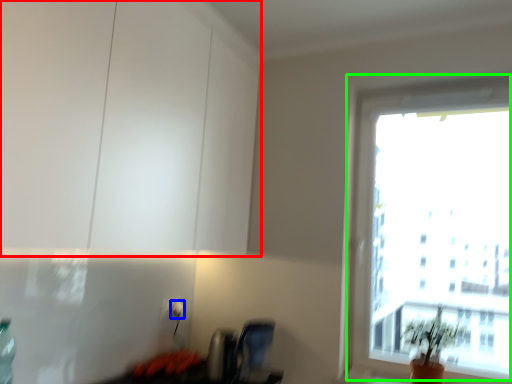
Question: Which object is the farthest from cabinetry (highlighted by a red box)? Choose among these: electric outlet (highlighted by a blue box) or window (highlighted by a green box).

Choices:
 (A) electric outlet
 (B) window

Answer: (B)